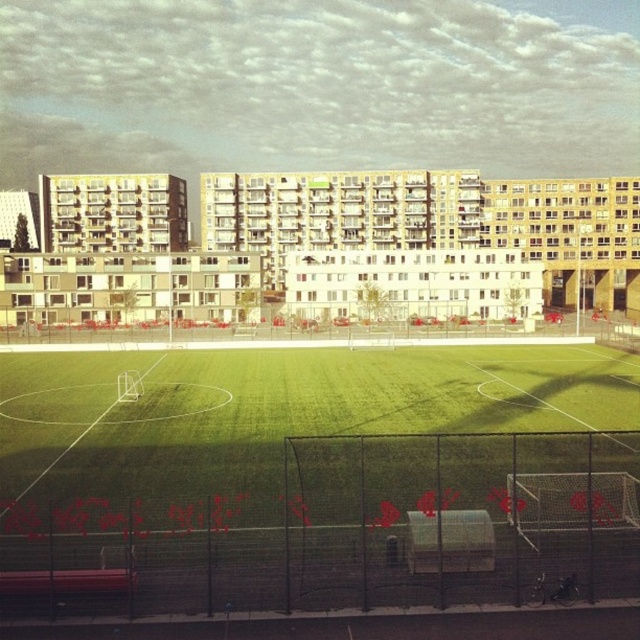
Question: Does green artificial turf at center have a greater width compared to green grass field at center?

Choices:
 (A) no
 (B) yes

Answer: (A)

Question: Observing the image, what is the correct spatial positioning of green artificial turf at center in reference to green grass field at center?

Choices:
 (A) below
 (B) above

Answer: (A)

Question: In this image, where is green artificial turf at center located relative to green grass field at center?

Choices:
 (A) right
 (B) left

Answer: (A)

Question: Which point is closer to the camera taking this photo?

Choices:
 (A) [333, 189]
 (B) [538, 451]

Answer: (B)